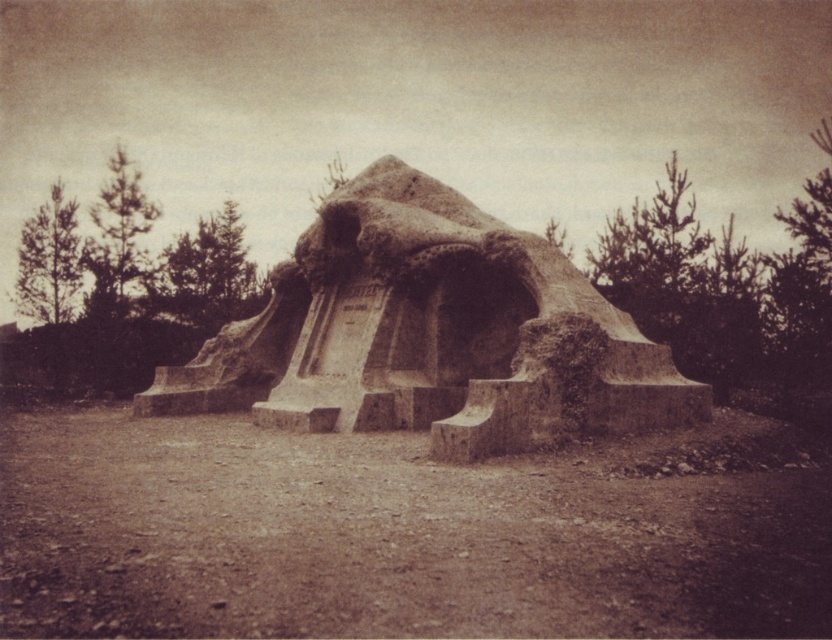
You are standing at the base of the monument and want to walk directly to the brown dirt field at center. How many steps will you need to climb to reach it?

The brown dirt field at center is 18.51 meters away from the camera, so you will need to climb the stone steps leading up to it. However, the exact number of steps isn generated in the description.

You are standing at the base of the stone sculpture and want to walk towards the brown dirt field at center. Which direction should you move relative to the rustic stone sculpture at center?

The brown dirt field at center is in front of rustic stone sculpture at center, so you should move forward towards it.